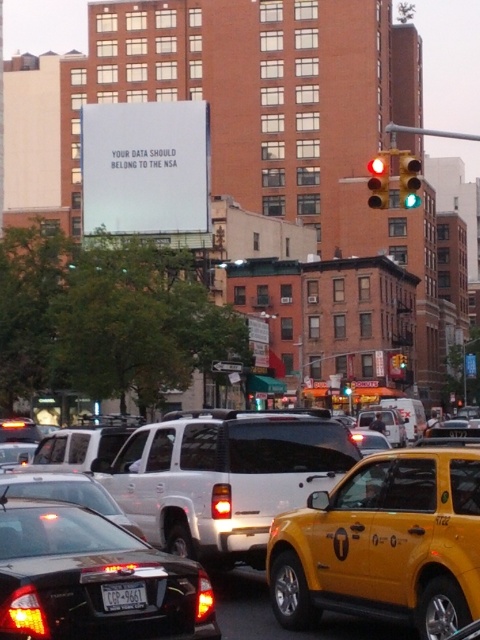
You are a pedestrian standing on the sidewalk and want to cross the street. You see the yellow matte taxi cab at center and the green glass traffic light at upper right. Which object is closer to your left side?

The yellow matte taxi cab at center is positioned on the left side of the green glass traffic light at upper right, so from your perspective as a pedestrian on the sidewalk, the yellow matte taxi cab at center would be closer to your left side.

You are a pedestrian standing on the sidewalk and see the white plastic license plate at center and the red glass traffic light at center. Which object is closer to the ground?

The white plastic license plate at center is located below the red glass traffic light at center, so it is closer to the ground.